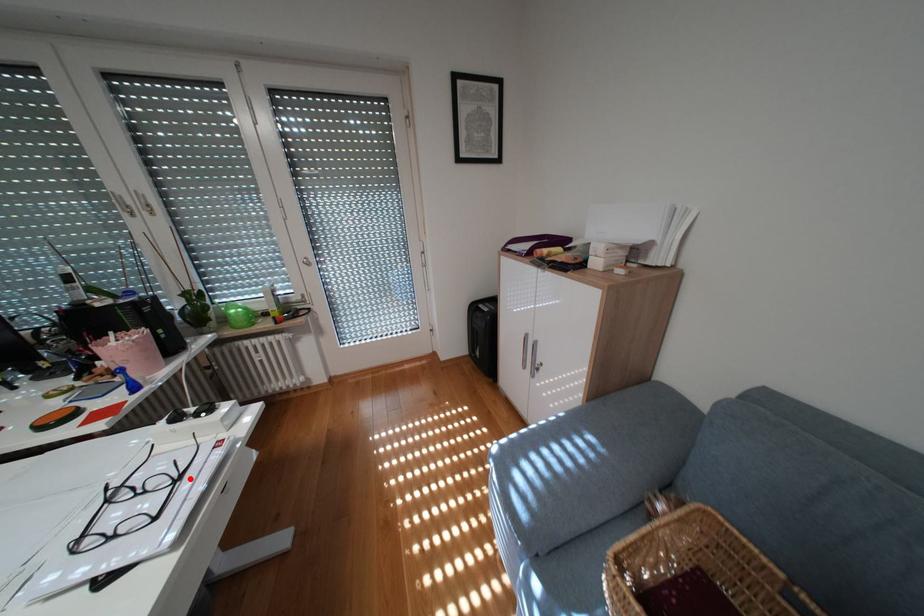
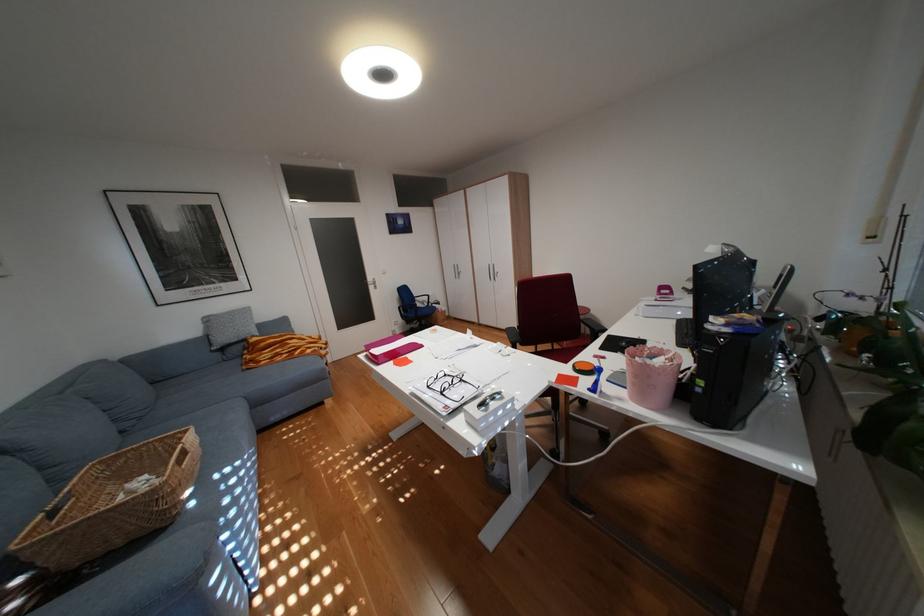
The point at the highlighted location is marked in the first image. Where is the corresponding point in the second image?

(454, 392)